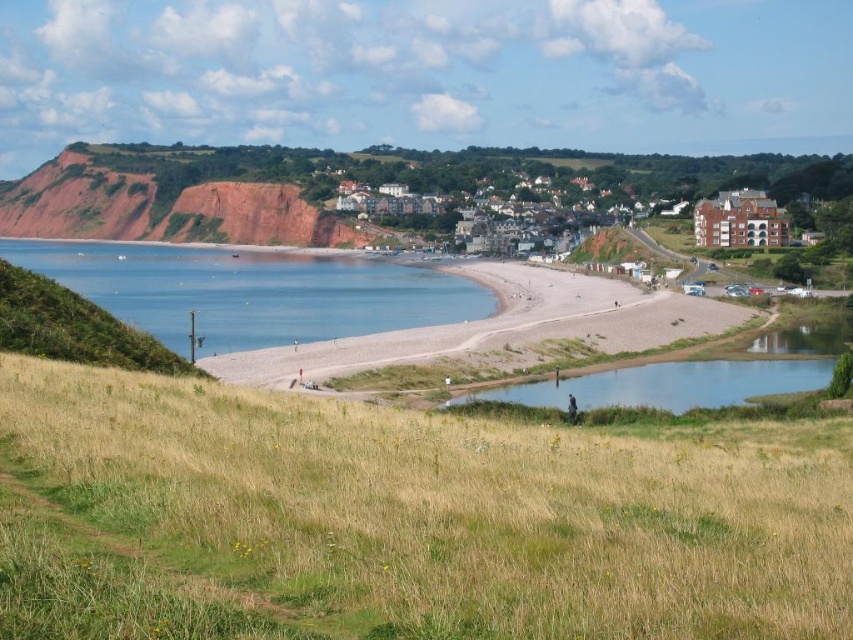
Question: Which point is farther to the camera?

Choices:
 (A) smooth sand beach at center
 (B) brown brick buildings at center
 (C) blue water at lower left
 (D) green grassy field at lower left

Answer: (B)

Question: Is smooth sand beach at center to the right of rustic clay cliff at upper left from the viewer's perspective?

Choices:
 (A) no
 (B) yes

Answer: (B)

Question: Is blue water at lower left positioned before brown brick buildings at center?

Choices:
 (A) no
 (B) yes

Answer: (B)

Question: Estimate the real-world distances between objects in this image. Which object is closer to the rustic clay cliff at upper left?

Choices:
 (A) smooth sand beach at center
 (B) brown brick buildings at center

Answer: (B)

Question: Which object is farther from the camera taking this photo?

Choices:
 (A) blue water at lower left
 (B) smooth sand beach at center
 (C) rustic clay cliff at upper left
 (D) brown brick buildings at center

Answer: (C)

Question: Does smooth sand beach at center appear under brown brick buildings at center?

Choices:
 (A) yes
 (B) no

Answer: (A)